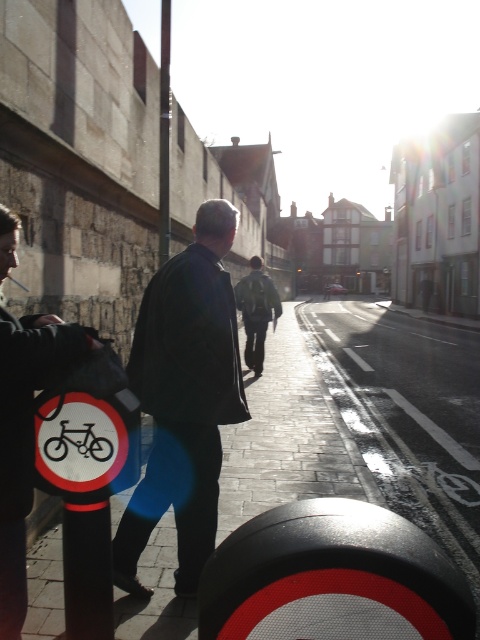
Question: Among these objects, which one is farthest from the camera?

Choices:
 (A) metallic pole at center
 (B) black rubber pole at lower left
 (C) metallic silver bicycle at center

Answer: (A)

Question: Which object is farther from the camera taking this photo?

Choices:
 (A) metallic silver bicycle at center
 (B) metallic pole at center
 (C) dark blue jacket at left

Answer: (B)

Question: Which object is farther from the camera taking this photo?

Choices:
 (A) metallic silver bicycle at center
 (B) metallic pole at center
 (C) white plastic bicycle at center

Answer: (B)

Question: Where is dark blue jacket at center located in relation to metallic silver bicycle at center in the image?

Choices:
 (A) left
 (B) right

Answer: (B)

Question: Can you confirm if dark matte jacket at center is positioned above metallic pole at center?

Choices:
 (A) yes
 (B) no

Answer: (B)

Question: Can you confirm if dark blue jacket at center is wider than metallic pole at center?

Choices:
 (A) no
 (B) yes

Answer: (A)